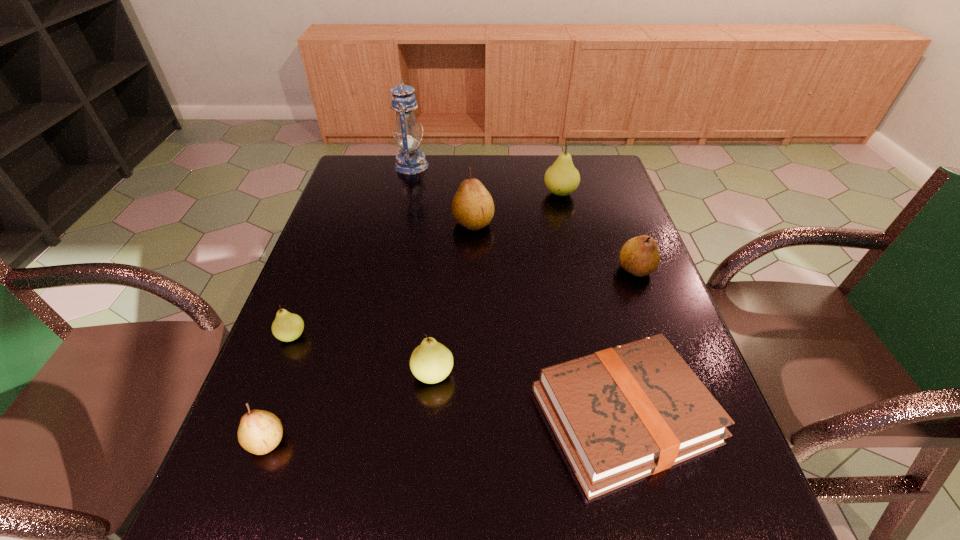
Locate an element on the screen. This screenshot has width=960, height=540. the leftmost green pear is located at coordinates (287, 326).

Locate an element on the screen. the smallest green pear is located at coordinates (287, 326).

Find the location of `the nearest brown pear`. the nearest brown pear is located at coordinates (259, 432).

The height and width of the screenshot is (540, 960). I want to click on the nearest pear, so click(259, 432).

Where is `the shortest object`? This screenshot has width=960, height=540. the shortest object is located at coordinates (621, 414).

The height and width of the screenshot is (540, 960). What are the coordinates of `free point located 0.120m on the front-facing side of the farthest object` in the screenshot? It's located at (463, 166).

Image resolution: width=960 pixels, height=540 pixels. What are the coordinates of `free region located on the left of the rightmost green pear` in the screenshot? It's located at (459, 193).

Locate an element on the screen. free spot located on the left of the second brown pear from left to right is located at coordinates (326, 223).

This screenshot has width=960, height=540. Find the location of `vacant space located 0.320m on the back of the fourth farthest object`. vacant space located 0.320m on the back of the fourth farthest object is located at coordinates (607, 191).

Where is `vacant area situated on the right of the second green pear from right to left`? This screenshot has width=960, height=540. vacant area situated on the right of the second green pear from right to left is located at coordinates (554, 374).